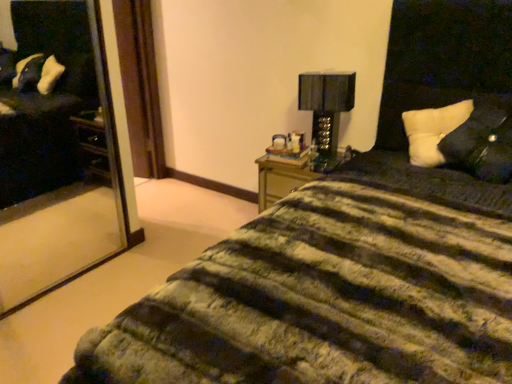
Question: From the image's perspective, is white soft pillow at upper right, which is the second pillow from front to back, above black glossy table lamp at upper right?

Choices:
 (A) yes
 (B) no

Answer: (B)

Question: Does white soft pillow at upper right, which is the second pillow from front to back, have a greater height compared to black glossy table lamp at upper right?

Choices:
 (A) yes
 (B) no

Answer: (B)

Question: Is white soft pillow at upper right, which is the second pillow from front to back, far from black glossy table lamp at upper right?

Choices:
 (A) yes
 (B) no

Answer: (B)

Question: Considering the relative positions of white soft pillow at upper right, which is the second pillow from front to back, and black glossy table lamp at upper right in the image provided, is white soft pillow at upper right, which is the second pillow from front to back, behind black glossy table lamp at upper right?

Choices:
 (A) no
 (B) yes

Answer: (A)

Question: Does white soft pillow at upper right, the first pillow when ordered from back to front, appear on the left side of black glossy table lamp at upper right?

Choices:
 (A) yes
 (B) no

Answer: (B)

Question: Is white soft pillow at upper right, which is the second pillow from front to back, thinner than black glossy table lamp at upper right?

Choices:
 (A) yes
 (B) no

Answer: (B)

Question: From the image's perspective, would you say white soft pillow at right, placed as the 2th pillow when sorted from back to front, is shown under white soft pillow at upper right, the first pillow when ordered from back to front?

Choices:
 (A) no
 (B) yes

Answer: (B)

Question: Is white soft pillow at upper right, the first pillow when ordered from back to front, at the back of white soft pillow at right, which appears as the 1th pillow when viewed from the front?

Choices:
 (A) no
 (B) yes

Answer: (B)

Question: From the image's perspective, does white soft pillow at right, which appears as the 1th pillow when viewed from the front, appear higher than white soft pillow at upper right, which is the second pillow from front to back?

Choices:
 (A) no
 (B) yes

Answer: (A)

Question: Is white soft pillow at right, placed as the 2th pillow when sorted from back to front, aimed at white soft pillow at upper right, the first pillow when ordered from back to front?

Choices:
 (A) yes
 (B) no

Answer: (A)

Question: Is white soft pillow at right, placed as the 2th pillow when sorted from back to front, to the left of white soft pillow at upper right, the first pillow when ordered from back to front, from the viewer's perspective?

Choices:
 (A) no
 (B) yes

Answer: (A)

Question: Considering the relative sizes of white soft pillow at right, placed as the 2th pillow when sorted from back to front, and white soft pillow at upper right, the first pillow when ordered from back to front, in the image provided, is white soft pillow at right, placed as the 2th pillow when sorted from back to front, taller than white soft pillow at upper right, the first pillow when ordered from back to front,?

Choices:
 (A) yes
 (B) no

Answer: (A)

Question: Can you confirm if black glossy table lamp at upper right is shorter than white soft pillow at upper right, the first pillow when ordered from back to front?

Choices:
 (A) no
 (B) yes

Answer: (A)